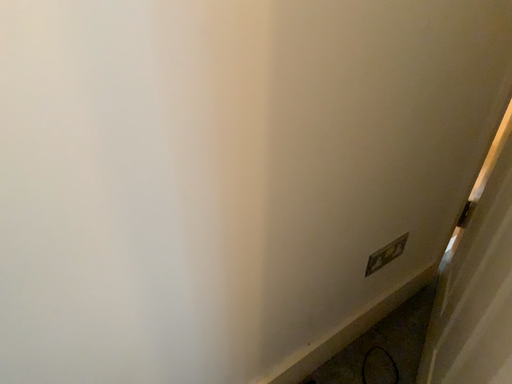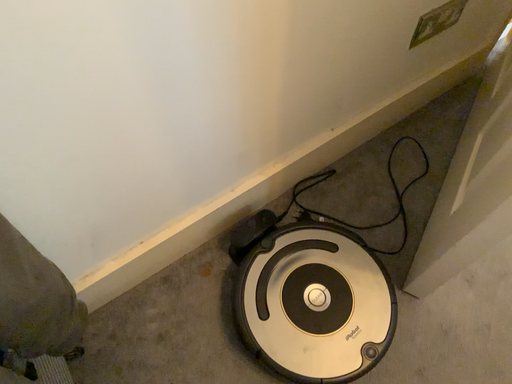
Question: How did the camera likely rotate when shooting the video?

Choices:
 (A) rotated downward
 (B) rotated upward

Answer: (A)